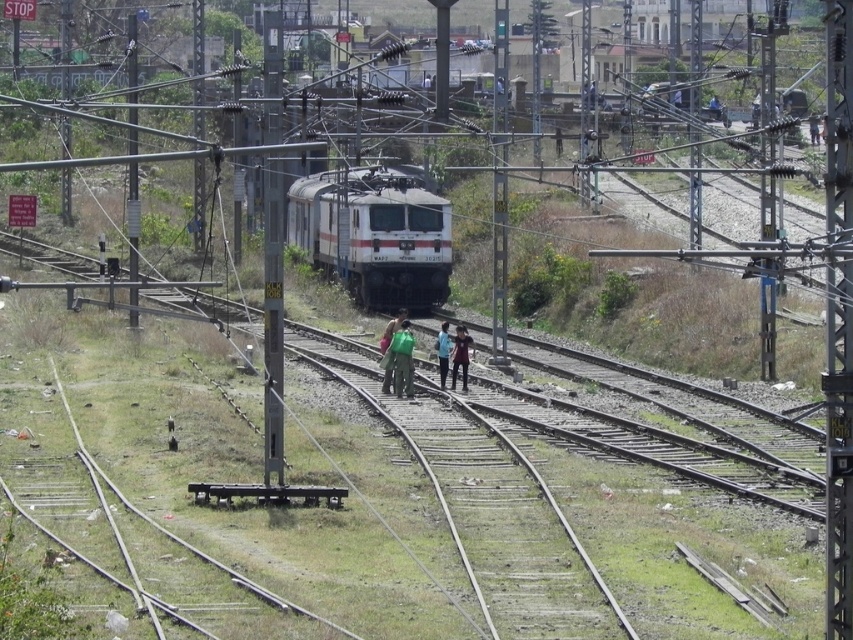
You are a passenger standing at the center of the image. You see a white glossy train at center and a dark blue shirt at center. Which object is closer to you?

The white glossy train at center is bigger than dark blue shirt at center, so it is closer to you.

You are a passenger on the train and see a green fabric bag at center and a blue fabric shirt at center. Which item is taller?

The green fabric bag at center is taller than the blue fabric shirt at center.

You are a passenger standing at the railway station and see the white glossy train at center and the blue fabric shirt at center. Which object is bigger in size?

The white glossy train at center is larger in size compared to the blue fabric shirt at center.